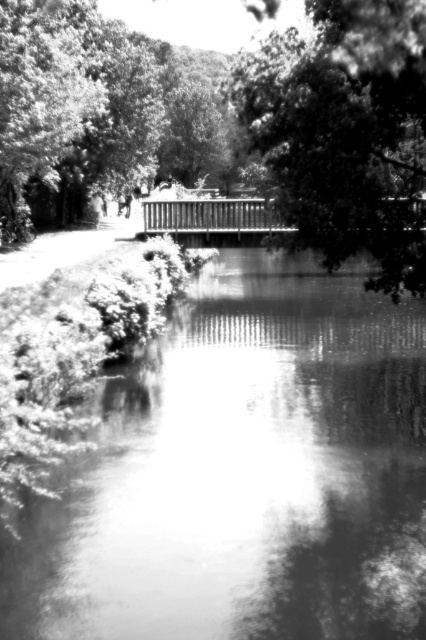
Question: Can you confirm if smooth water at center is positioned below smooth green leafy tree at center?

Choices:
 (A) no
 (B) yes

Answer: (B)

Question: Can you confirm if smooth water at center is thinner than smooth green leafy tree at center?

Choices:
 (A) no
 (B) yes

Answer: (A)

Question: Which point is farther to the camera?

Choices:
 (A) smooth green leafy tree at center
 (B) smooth water at center

Answer: (A)

Question: Observing the image, what is the correct spatial positioning of smooth water at center in reference to smooth green leafy tree at center?

Choices:
 (A) below
 (B) above

Answer: (A)

Question: Among these points, which one is farthest from the camera?

Choices:
 (A) (386, 12)
 (B) (313, 538)

Answer: (B)